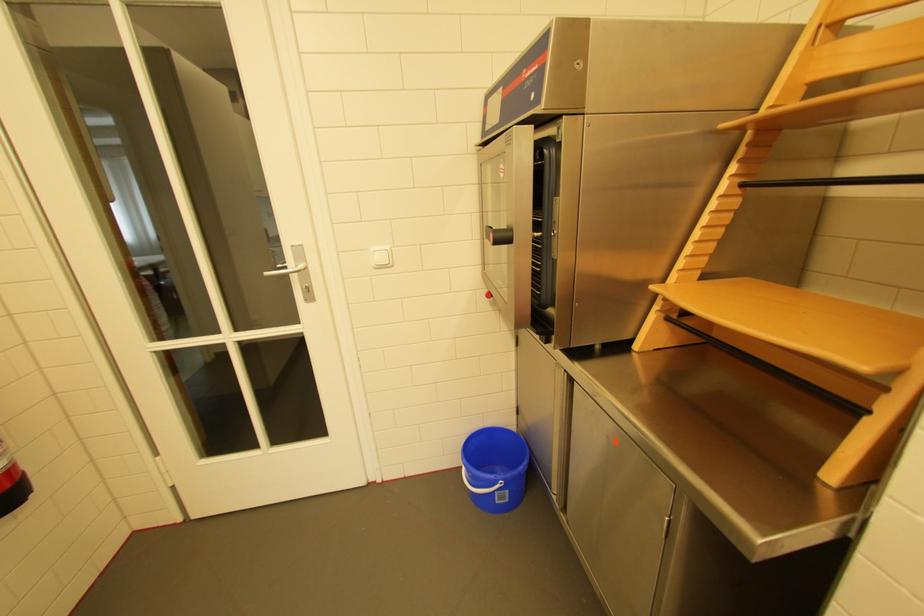
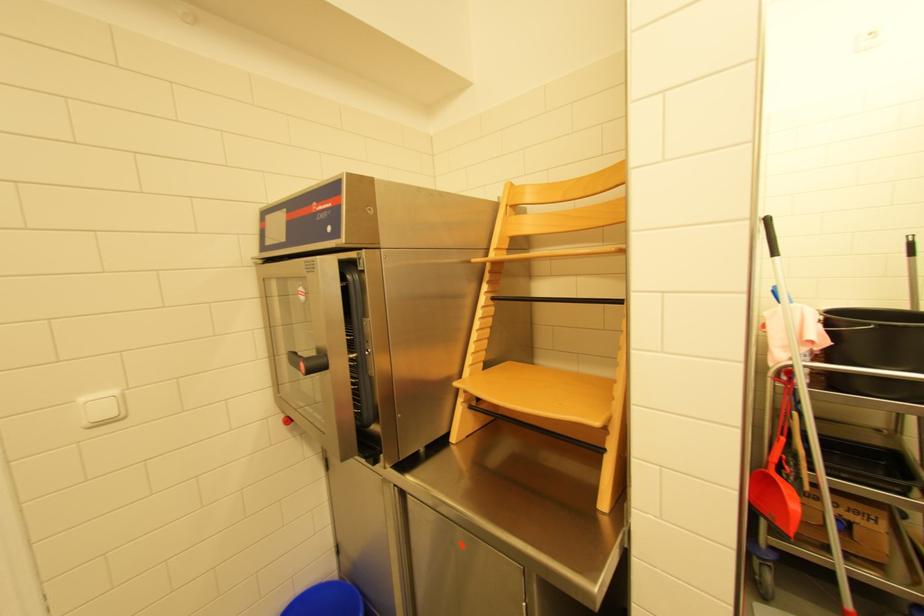
The point at (500, 241) is marked in the first image. Where is the corresponding point in the second image?

(311, 371)